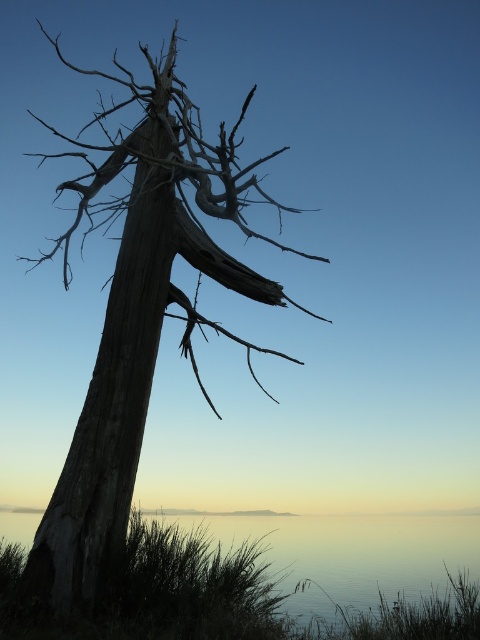
Which is more to the right, gray textured wood at left or gray rough bark tree trunk at left?

From the viewer's perspective, gray textured wood at left appears more on the right side.

Does gray textured wood at left appear under gray rough bark tree trunk at left?

No.

Is point (159, 141) positioned after point (148, 195)?

Yes, it is behind point (148, 195).

Locate an element on the screen. This screenshot has width=480, height=640. gray textured wood at left is located at coordinates (139, 316).

Who is taller, gray rough bark tree trunk at left or smooth glass water at lower center?

With more height is gray rough bark tree trunk at left.

Is point (101, 332) positioned before point (186, 524)?

Yes, point (101, 332) is closer to viewer.

Is point (132, 477) positioned before point (455, 524)?

That is True.

I want to click on gray rough bark tree trunk at left, so click(108, 413).

Is gray textured wood at left closer to camera compared to smooth glass water at lower center?

Yes, it is.

Which is more to the left, gray textured wood at left or smooth glass water at lower center?

From the viewer's perspective, gray textured wood at left appears more on the left side.

Identify the location of gray textured wood at left. (139, 316).

The image size is (480, 640). I want to click on gray textured wood at left, so click(x=139, y=316).